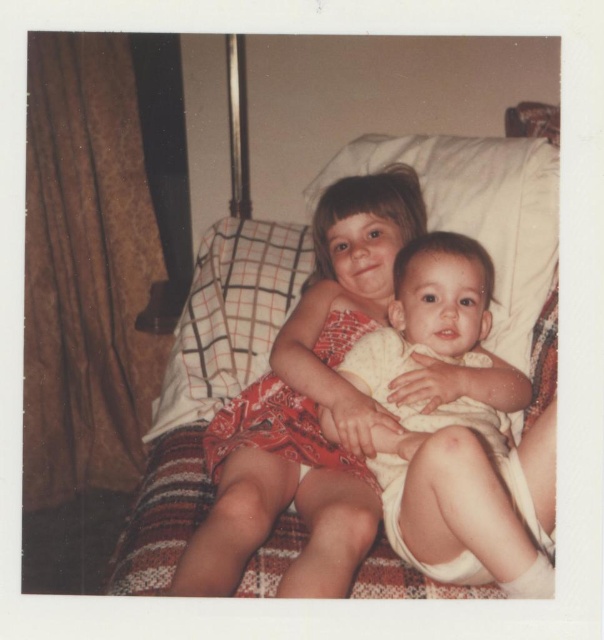
You are a toy delivery robot that needs to place a small stuffed animal between the matte red dress at center and the white checkered pillow at upper left. The stuffed animal is 10 inches wide. Will it fit in the space between them?

The distance between the matte red dress at center and the white checkered pillow at upper left is 10.18 inches. Since the stuffed animal is 10 inches wide, it will fit in the space between them as there is enough room.

You are a parent trying to change the younger child. You see the white cloth diaper at center and the white checkered pillow at upper left. Which item is thinner?

The white cloth diaper at center is thinner than the white checkered pillow at upper left.